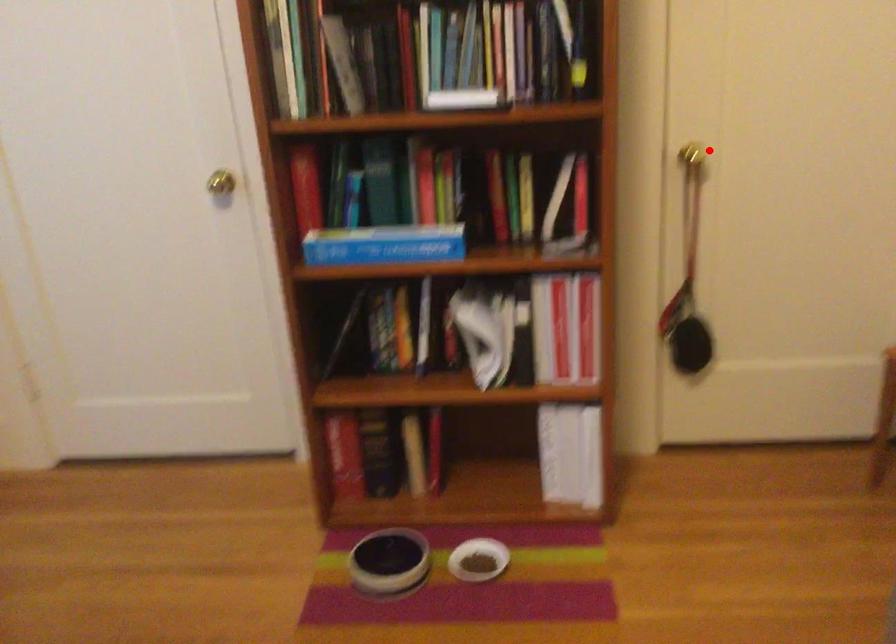
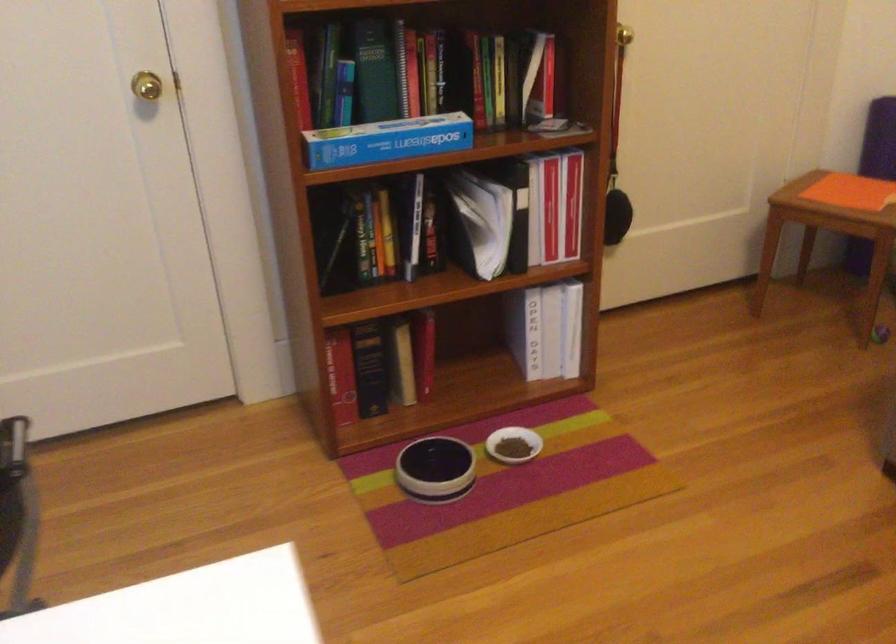
Where in the second image is the point corresponding to the highlighted location from the first image?

(624, 35)